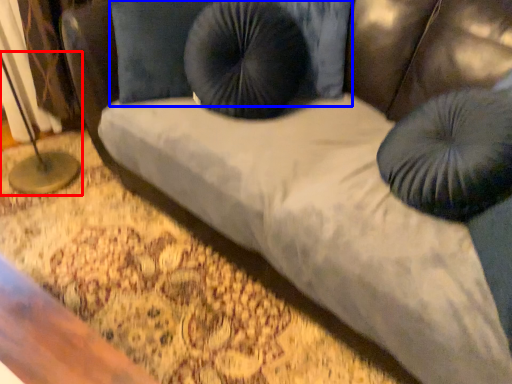
Question: Which object appears closest to the camera in this image, table lamp (highlighted by a red box) or pillow (highlighted by a blue box)?

Choices:
 (A) table lamp
 (B) pillow

Answer: (B)